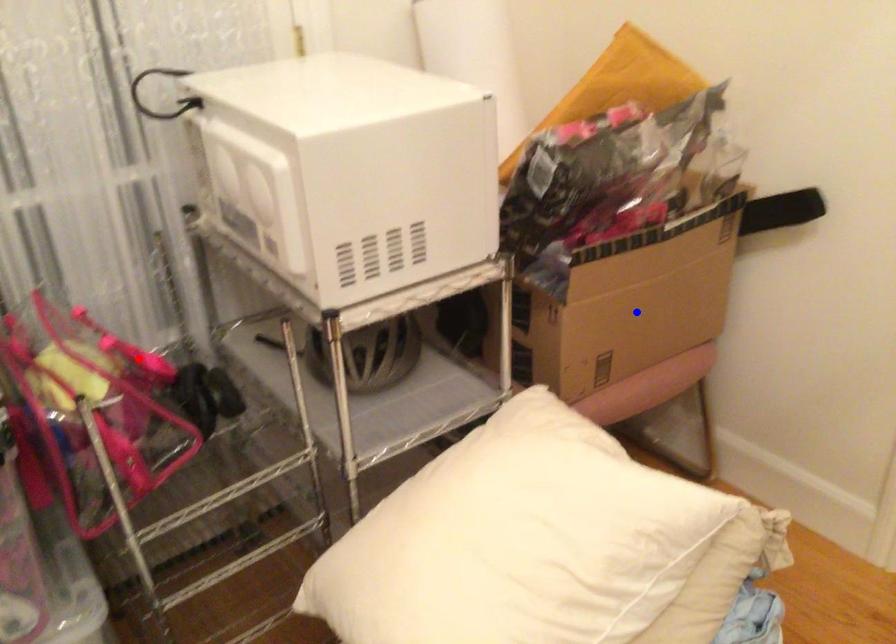
Question: Two points are marked on the image. Which point is closer to the camera?

Choices:
 (A) Blue point is closer.
 (B) Red point is closer.

Answer: (B)